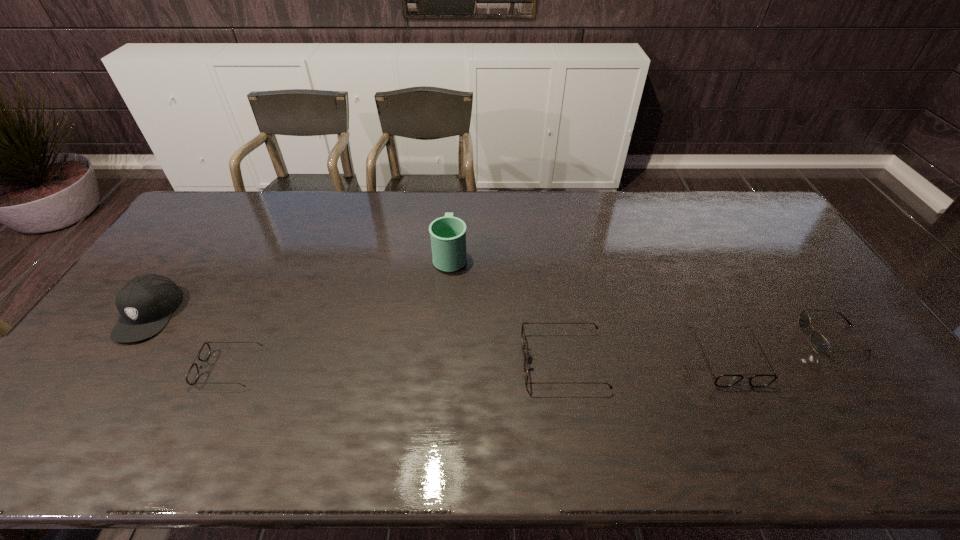
The width and height of the screenshot is (960, 540). I want to click on the leftmost sunglasses, so click(x=204, y=353).

The height and width of the screenshot is (540, 960). I want to click on the fifth object from right to left, so click(x=204, y=353).

Identify the location of the fourth shortest object. (523, 331).

At what (x,y) coordinates should I click in order to perform the action: click on the third sunglasses from right to left. Please return your answer as a coordinate pair (x, y). This screenshot has height=540, width=960. Looking at the image, I should click on (523, 331).

Locate an element on the screen. The width and height of the screenshot is (960, 540). the fifth object from left to right is located at coordinates (726, 380).

Locate an element on the screen. the fifth shortest object is located at coordinates (146, 302).

Locate an element on the screen. the leftmost object is located at coordinates (146, 302).

Locate an element on the screen. The height and width of the screenshot is (540, 960). the rightmost sunglasses is located at coordinates (819, 343).

Image resolution: width=960 pixels, height=540 pixels. I want to click on the third object from left to right, so click(x=448, y=234).

At what (x,y) coordinates should I click in order to perform the action: click on mug. Please return your answer as a coordinate pair (x, y). Looking at the image, I should click on (448, 234).